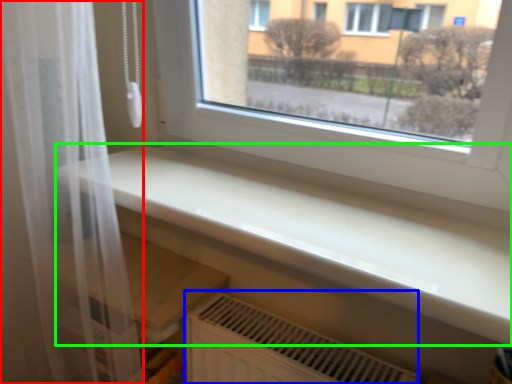
Question: Which object is positioned closest to shower curtain (highlighted by a red box)? Select from air conditioning (highlighted by a blue box) and counter top (highlighted by a green box).

Choices:
 (A) air conditioning
 (B) counter top

Answer: (B)